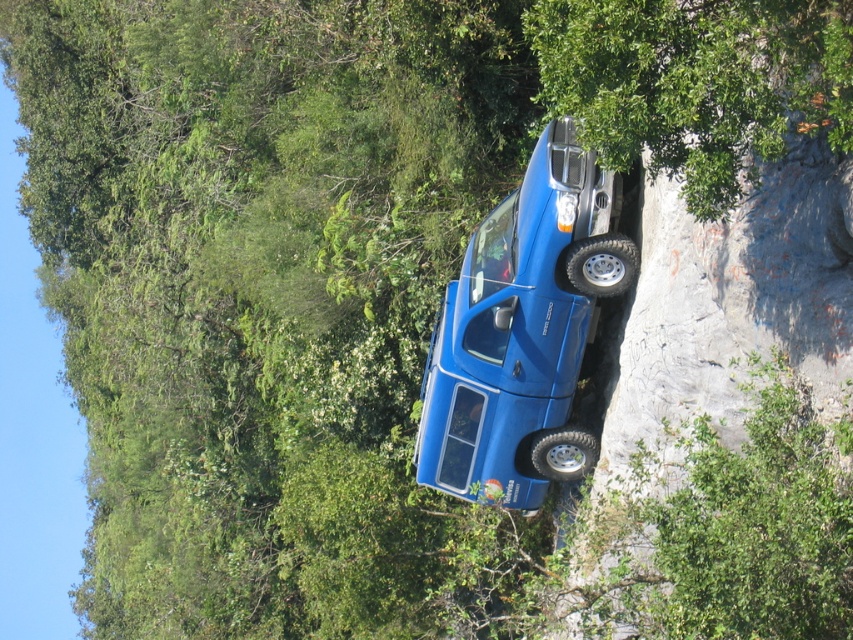
Question: Can you confirm if matte blue jeep at center is positioned to the left of green leafy tree at upper right?

Choices:
 (A) yes
 (B) no

Answer: (A)

Question: From the image, what is the correct spatial relationship of matte blue jeep at center in relation to green leafy tree at upper right?

Choices:
 (A) right
 (B) left

Answer: (B)

Question: Which object is closer to the camera taking this photo?

Choices:
 (A) matte blue jeep at center
 (B) green leafy tree at upper right

Answer: (B)

Question: Which object is farther from the camera taking this photo?

Choices:
 (A) green leafy tree at upper right
 (B) matte blue jeep at center

Answer: (B)

Question: Is matte blue jeep at center thinner than green leafy tree at upper right?

Choices:
 (A) no
 (B) yes

Answer: (B)